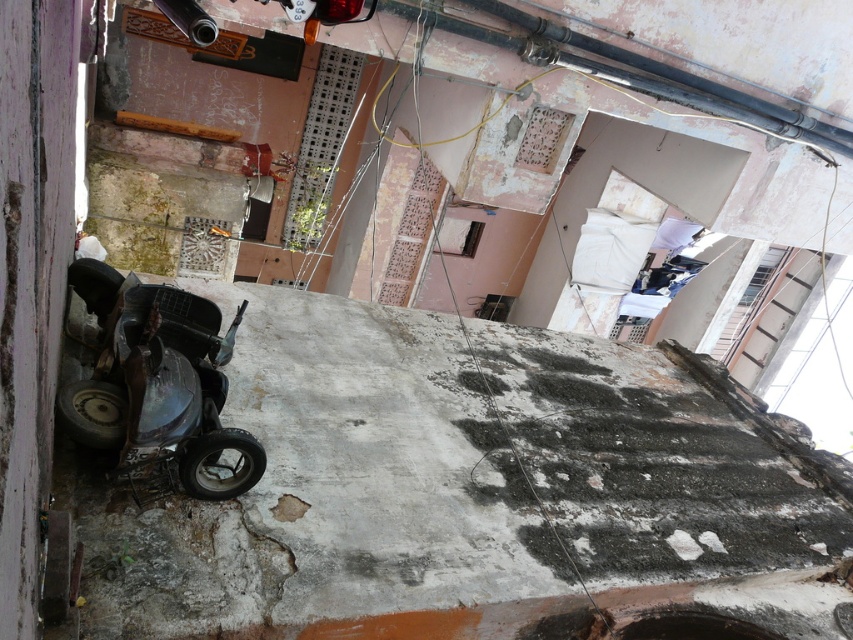
Question: Is gray concrete at lower left wider than metallic matte mower at lower left?

Choices:
 (A) yes
 (B) no

Answer: (A)

Question: Which point is farther to the camera?

Choices:
 (A) (68, 280)
 (B) (764, 573)

Answer: (B)

Question: Does gray concrete at lower left appear on the right side of metallic matte mower at lower left?

Choices:
 (A) no
 (B) yes

Answer: (B)

Question: Which of the following is the closest to the observer?

Choices:
 (A) (166, 611)
 (B) (200, 333)

Answer: (A)

Question: Does gray concrete at lower left appear on the left side of metallic matte mower at lower left?

Choices:
 (A) yes
 (B) no

Answer: (B)